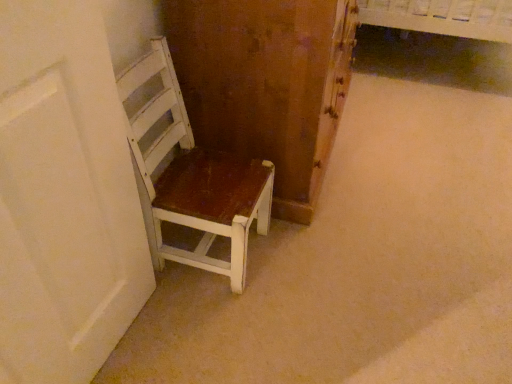
The height and width of the screenshot is (384, 512). What do you see at coordinates (194, 175) in the screenshot?
I see `white painted wood chair at left` at bounding box center [194, 175].

The image size is (512, 384). What are the coordinates of `white painted wood chair at left` in the screenshot? It's located at (194, 175).

Image resolution: width=512 pixels, height=384 pixels. I want to click on white painted wood chair at left, so point(194,175).